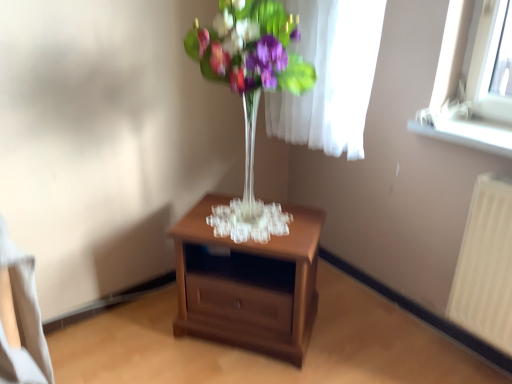
Question: Is white plastic radiator at right positioned behind white plastic window sill at upper right?

Choices:
 (A) no
 (B) yes

Answer: (A)

Question: Is white plastic radiator at right not near white plastic window sill at upper right?

Choices:
 (A) no
 (B) yes

Answer: (A)

Question: From a real-world perspective, is white plastic radiator at right positioned under white plastic window sill at upper right based on gravity?

Choices:
 (A) yes
 (B) no

Answer: (A)

Question: Considering the relative sizes of white plastic radiator at right and white plastic window sill at upper right in the image provided, is white plastic radiator at right shorter than white plastic window sill at upper right?

Choices:
 (A) yes
 (B) no

Answer: (B)

Question: Is the surface of white plastic radiator at right in direct contact with white plastic window sill at upper right?

Choices:
 (A) no
 (B) yes

Answer: (A)

Question: Is point (485, 208) closer or farther from the camera than point (220, 54)?

Choices:
 (A) farther
 (B) closer

Answer: (A)

Question: Would you say white plastic radiator at right is inside or outside clear glass vase at center?

Choices:
 (A) outside
 (B) inside

Answer: (A)

Question: From the image's perspective, relative to clear glass vase at center, is white plastic radiator at right above or below?

Choices:
 (A) below
 (B) above

Answer: (A)

Question: Visually, is white plastic radiator at right positioned to the left or to the right of clear glass vase at center?

Choices:
 (A) right
 (B) left

Answer: (A)

Question: Considering the positions of white plastic radiator at right and brown wooden nightstand at center in the image, is white plastic radiator at right wider or thinner than brown wooden nightstand at center?

Choices:
 (A) thin
 (B) wide

Answer: (A)

Question: Does point (498, 289) appear closer or farther from the camera than point (224, 241)?

Choices:
 (A) farther
 (B) closer

Answer: (B)

Question: From their relative heights in the image, would you say white plastic radiator at right is taller or shorter than brown wooden nightstand at center?

Choices:
 (A) tall
 (B) short

Answer: (A)

Question: Considering the relative positions of white plastic radiator at right and brown wooden nightstand at center in the image provided, is white plastic radiator at right to the left or to the right of brown wooden nightstand at center?

Choices:
 (A) right
 (B) left

Answer: (A)

Question: Considering the positions of point click(472, 225) and point click(418, 110), is point click(472, 225) closer or farther from the camera than point click(418, 110)?

Choices:
 (A) closer
 (B) farther

Answer: (A)

Question: From a real-world perspective, relative to white plastic window sill at upper right, is white plastic radiator at right vertically above or below?

Choices:
 (A) above
 (B) below

Answer: (B)